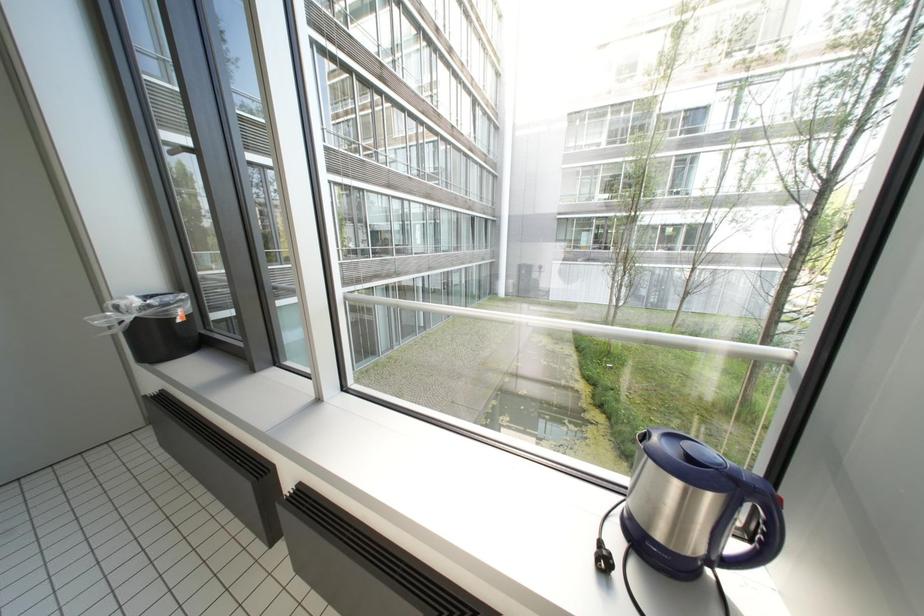
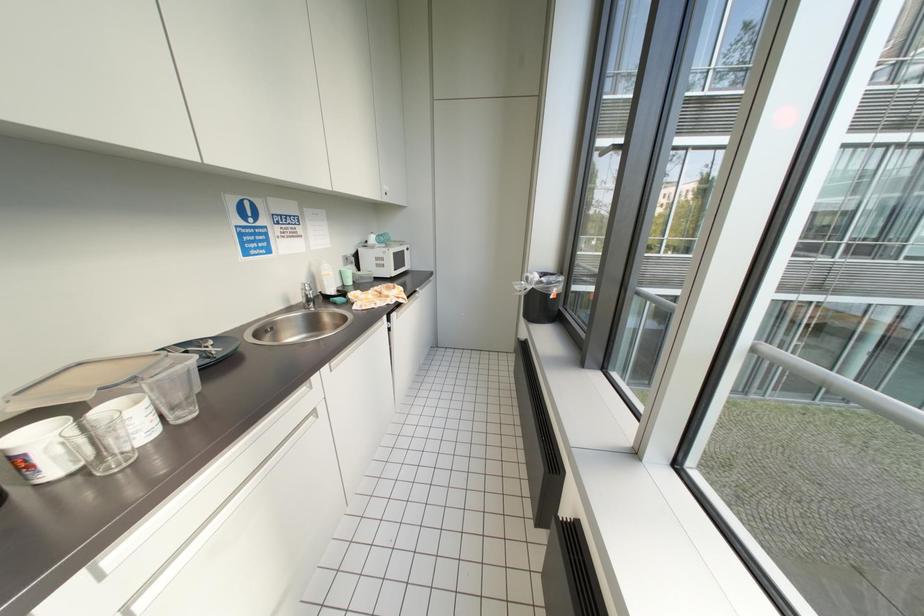
Question: Based on the continuous images, in which direction is the camera rotating? Reply with the corresponding letter.

Choices:
 (A) Left
 (B) Right
 (C) Up
 (D) Down

Answer: (A)